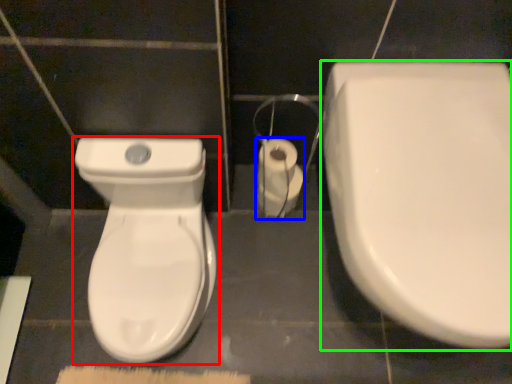
Question: Based on their relative distances, which object is farther from toilet (highlighted by a red box)? Choose from toilet paper (highlighted by a blue box) and toilet (highlighted by a green box).

Choices:
 (A) toilet paper
 (B) toilet

Answer: (B)